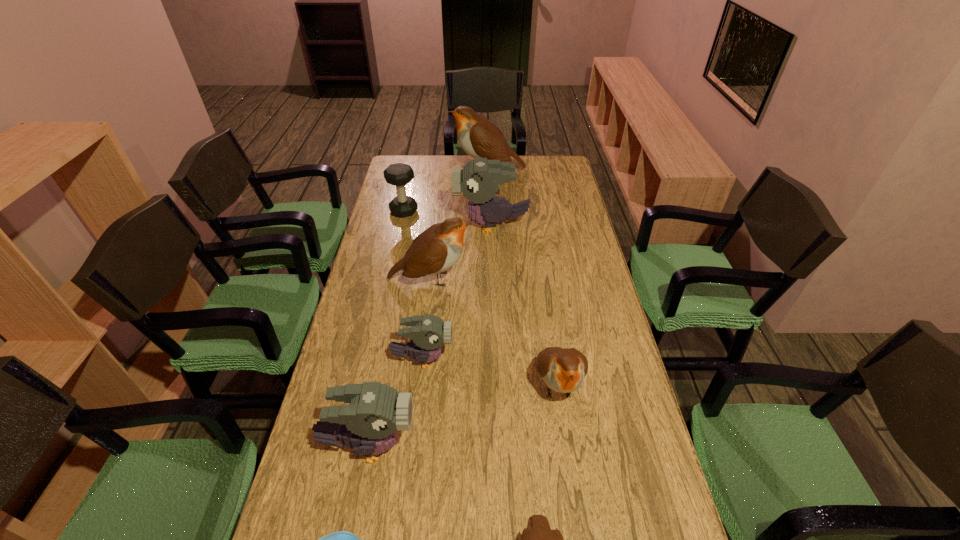
Where is `the smallest gray bird`? the smallest gray bird is located at coordinates (429, 332).

Identify the location of vacant space positioned 0.090m at the face of the farthest object. (432, 170).

Image resolution: width=960 pixels, height=540 pixels. In order to click on free space located at the face of the farthest object in this screenshot , I will do `click(415, 170)`.

Locate an element on the screen. free space located 0.090m at the face of the farthest object is located at coordinates (432, 170).

Locate an element on the screen. This screenshot has height=540, width=960. vacant space located 0.100m at the beak of the biggest gray bird is located at coordinates (429, 226).

Locate an element on the screen. Image resolution: width=960 pixels, height=540 pixels. blank space located at the beak of the biggest gray bird is located at coordinates (440, 226).

At what (x,y) coordinates should I click in order to perform the action: click on vacant space situated at the beak of the biggest gray bird. Please return your answer as a coordinate pair (x, y). This screenshot has height=540, width=960. Looking at the image, I should click on (375, 226).

Where is `free space located at the face of the second farthest brown bird`? This screenshot has width=960, height=540. free space located at the face of the second farthest brown bird is located at coordinates pyautogui.click(x=564, y=279).

Where is `free region located 0.150m at the beak of the second biggest gray bird`? The height and width of the screenshot is (540, 960). free region located 0.150m at the beak of the second biggest gray bird is located at coordinates (477, 446).

At what (x,y) coordinates should I click in order to perform the action: click on vacant space located at the face of the third farthest brown bird. Please return your answer as a coordinate pair (x, y). This screenshot has height=540, width=960. Looking at the image, I should click on click(x=578, y=523).